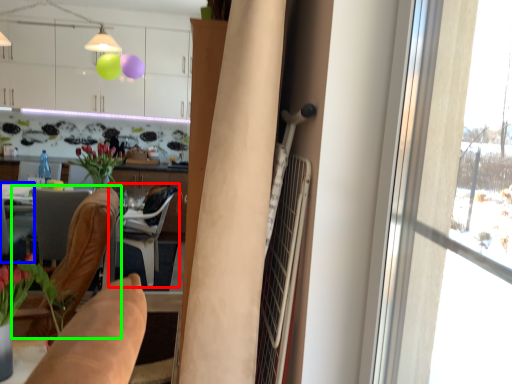
Question: Based on their relative distances, which object is farther from chair (highlighted by a red box)? Choose from chair (highlighted by a blue box) and chair (highlighted by a green box).

Choices:
 (A) chair
 (B) chair

Answer: (B)